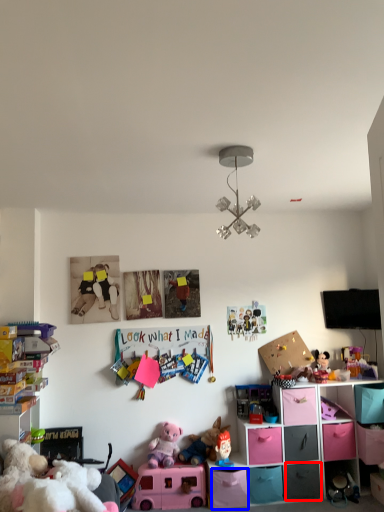
Question: Among these objects, which one is nearest to the camera, drawer (highlighted by a red box) or drawer (highlighted by a blue box)?

Choices:
 (A) drawer
 (B) drawer

Answer: (B)